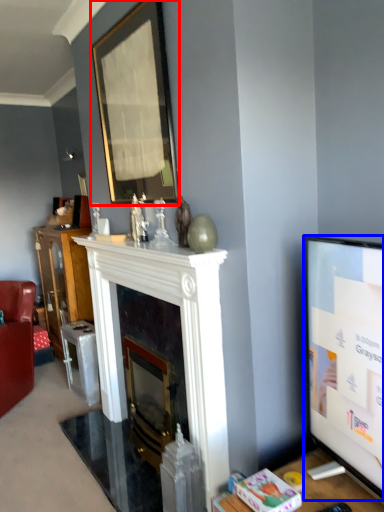
Question: Which point is closer to the camera, picture frame (highlighted by a red box) or television (highlighted by a blue box)?

Choices:
 (A) picture frame
 (B) television

Answer: (B)